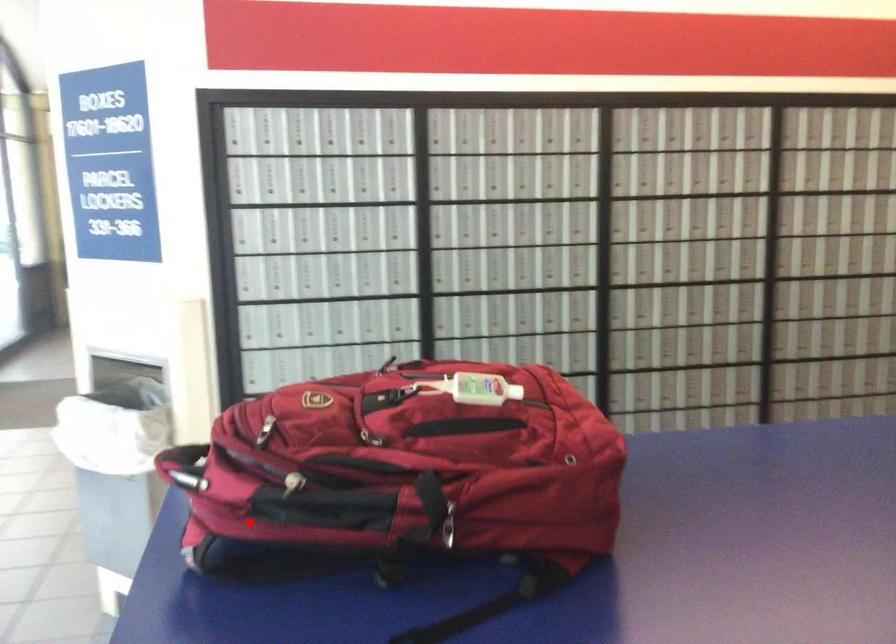
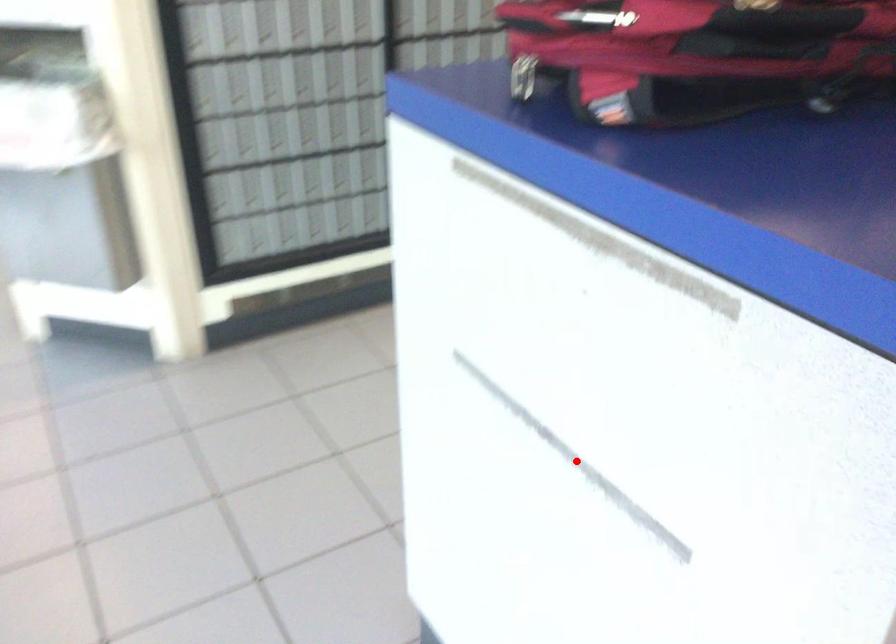
I am providing you with two images of the same scene from different viewpoints. A red point is marked on the first image and another point is marked on the second image. Is the marked point in image1 the same physical position as the marked point in image2?

No